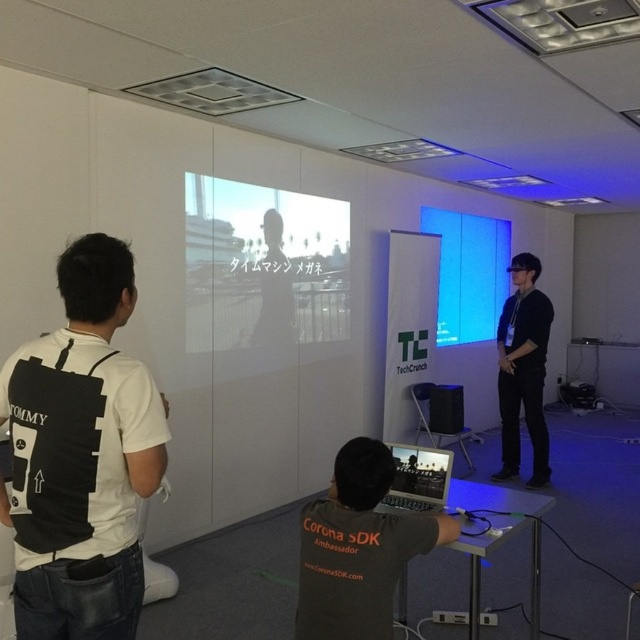
You are attending a tech event and want to present your slide. You have a silver metallic laptop at center and a transparent glass at center. Which device should you use to connect to the projector?

The silver metallic laptop at center is behind the transparent glass at center, so you should use the silver metallic laptop at center to connect to the projector since it is positioned behind the glass, likely indicating it is the source of the projection.

You are a technician needing to move a 2.5 meter long cable from the transparent glass at center to the silver metallic laptop at center. Can the cable reach the laptop without needing to extend it further?

The distance between the transparent glass at center and the silver metallic laptop at center is 2.26 meters. Since the cable is 2.5 meters long, it is longer than the required distance, so the cable can easily reach the laptop without needing to extend it further.

You are attending a tech event and want to take a photo of the black plastic projector at center without blocking the transparent glass at center. Which side should you stand to avoid blocking the glass?

You should stand to the right of the black plastic projector at center to avoid blocking the transparent glass at center, since the glass is located to its left.